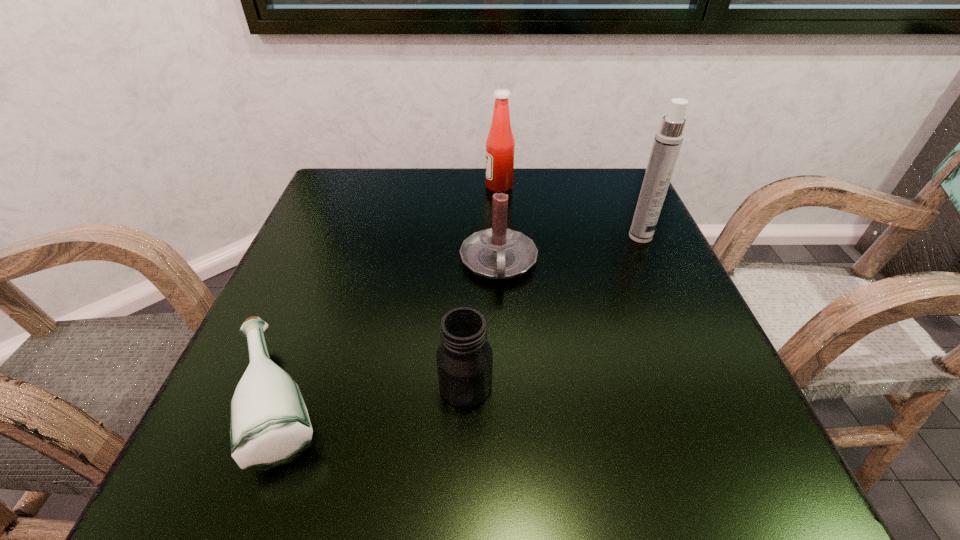
Locate an element on the screen. This screenshot has width=960, height=540. free location located on the front-facing side of the farthest object is located at coordinates (324, 186).

I want to click on vacant space located on the front-facing side of the farthest object, so click(x=393, y=186).

Where is `vacant region located on the side of the candle with the handle loop`? This screenshot has width=960, height=540. vacant region located on the side of the candle with the handle loop is located at coordinates (502, 334).

Identify the location of vacant point located 0.120m on the front of the jar. The width and height of the screenshot is (960, 540). (463, 495).

Locate an element on the screen. This screenshot has height=540, width=960. vacant space located on the right of the shortest object is located at coordinates point(486,400).

Image resolution: width=960 pixels, height=540 pixels. Find the location of `object positioned at the far edge`. object positioned at the far edge is located at coordinates (500, 145).

Where is `object located at the near edge`? The height and width of the screenshot is (540, 960). object located at the near edge is located at coordinates (269, 423).

What are the coordinates of `object that is at the left edge` in the screenshot? It's located at (269, 423).

This screenshot has width=960, height=540. I want to click on object present at the right edge, so click(668, 139).

Locate an element on the screen. object present at the near left corner is located at coordinates (269, 423).